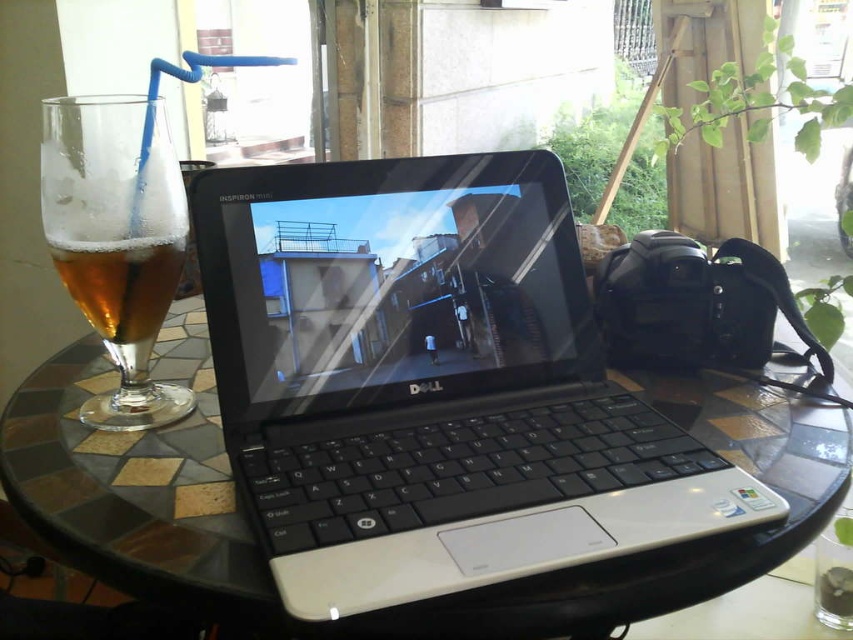
Question: Is black plastic laptop at center smaller than amber glass at left?

Choices:
 (A) yes
 (B) no

Answer: (B)

Question: Is the position of black plastic laptop at center more distant than that of amber glass at left?

Choices:
 (A) yes
 (B) no

Answer: (B)

Question: Which point is farther to the camera?

Choices:
 (A) black plastic laptop at center
 (B) amber glass at left

Answer: (B)

Question: Can you confirm if black plastic laptop at center is wider than amber glass at left?

Choices:
 (A) yes
 (B) no

Answer: (A)